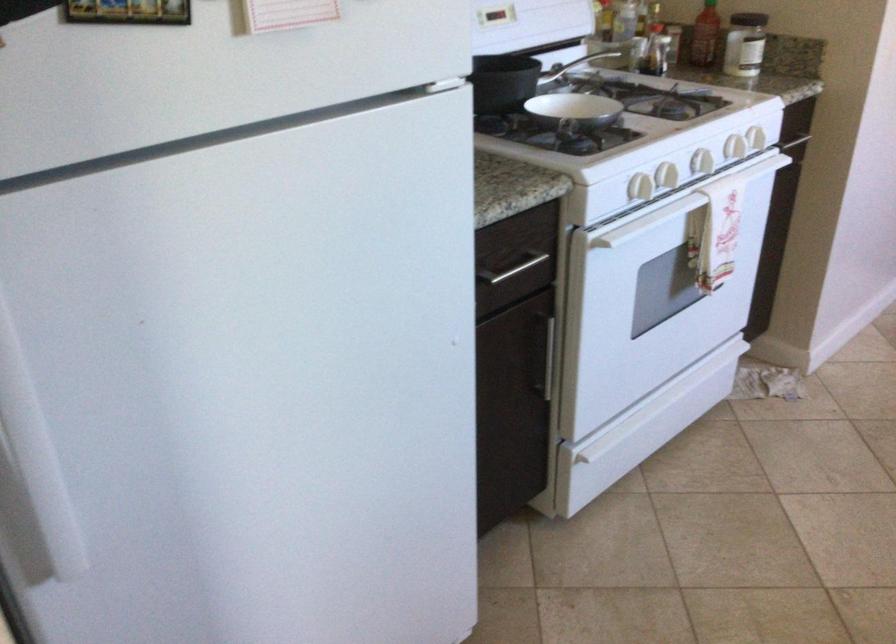
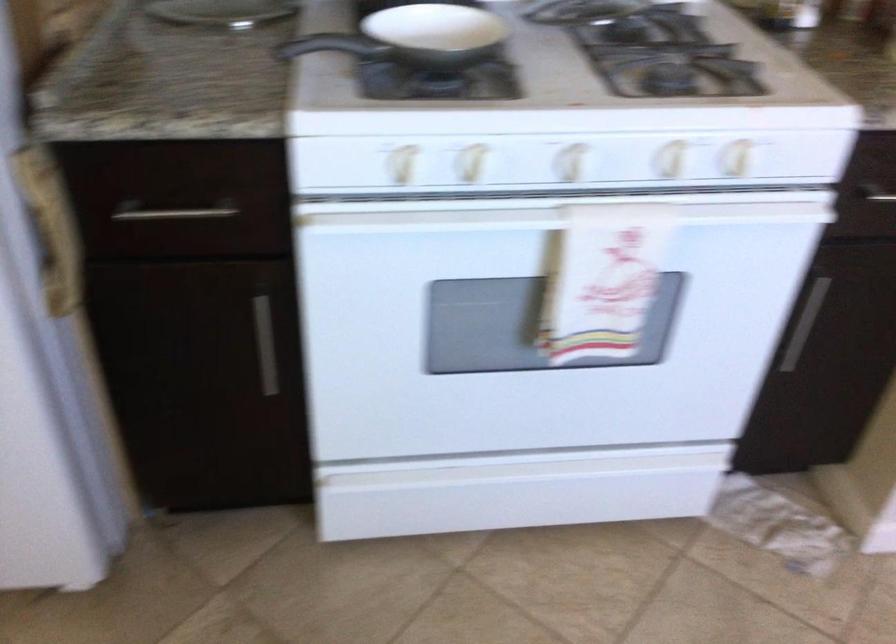
Where in the second image is the point corresponding to pixel 702 128 from the first image?

(573, 162)